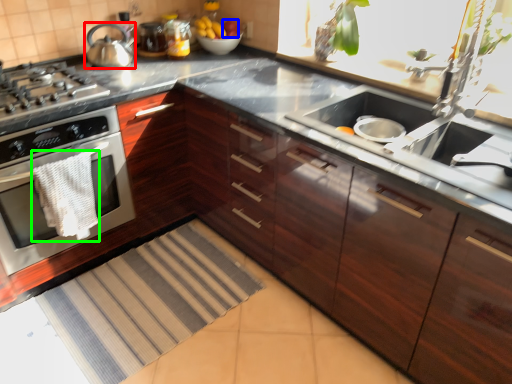
Question: Estimate the real-world distances between objects in this image. Which object is closer to kitchen appliance (highlighted by a red box), apple (highlighted by a blue box) or material (highlighted by a green box)?

Choices:
 (A) apple
 (B) material

Answer: (A)